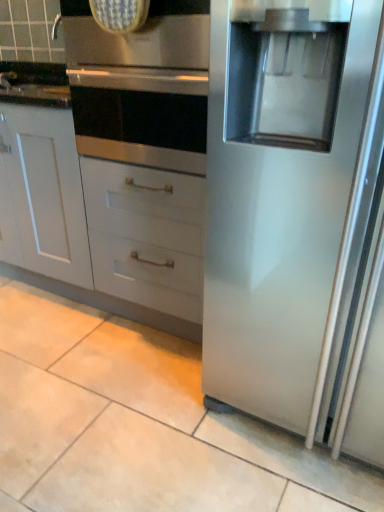
Question: From a real-world perspective, relative to white matte cabinet at lower left, is stainless steel oven at upper center vertically above or below?

Choices:
 (A) above
 (B) below

Answer: (A)

Question: In terms of width, does stainless steel oven at upper center look wider or thinner when compared to white matte cabinet at lower left?

Choices:
 (A) wide
 (B) thin

Answer: (A)

Question: Is point (89, 46) positioned closer to the camera than point (39, 226)?

Choices:
 (A) farther
 (B) closer

Answer: (B)

Question: Is white matte cabinet at lower left wider or thinner than stainless steel oven at upper center?

Choices:
 (A) thin
 (B) wide

Answer: (A)

Question: Is white matte cabinet at lower left to the left or to the right of stainless steel oven at upper center in the image?

Choices:
 (A) right
 (B) left

Answer: (B)

Question: From the image's perspective, is white matte cabinet at lower left positioned above or below stainless steel oven at upper center?

Choices:
 (A) above
 (B) below

Answer: (B)

Question: From a real-world perspective, relative to stainless steel oven at upper center, is white matte cabinet at lower left vertically above or below?

Choices:
 (A) above
 (B) below

Answer: (B)